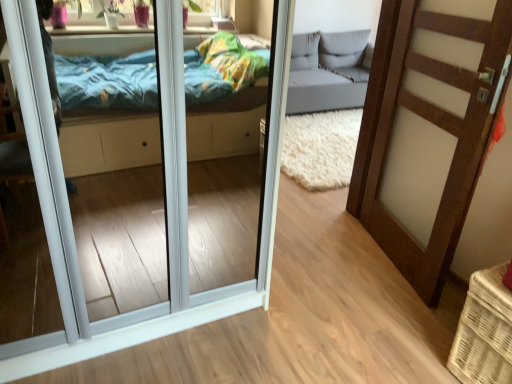
Where is `vacant space to the right of white glossy door at center, acting as the 2th door starting from the right`? vacant space to the right of white glossy door at center, acting as the 2th door starting from the right is located at coordinates (300, 312).